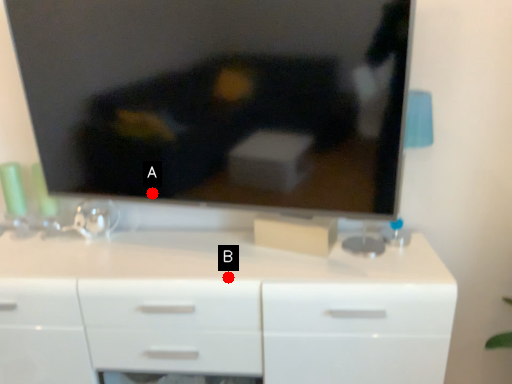
Question: Two points are circled on the image, labeled by A and B beside each circle. Which point is farther to the camera?

Choices:
 (A) A is further
 (B) B is further

Answer: (A)